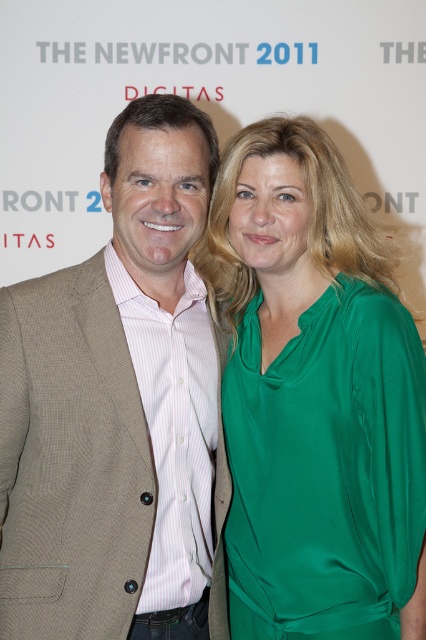
Is green satin blouse at center below brown textured blazer at left?

Yes, green satin blouse at center is below brown textured blazer at left.

Between green satin blouse at center and brown textured blazer at left, which one is positioned lower?

Positioned lower is green satin blouse at center.

Which is in front, point (425, 547) or point (155, 378)?

Point (425, 547)

Find the location of a particular element. This screenshot has width=426, height=640. green satin blouse at center is located at coordinates pyautogui.click(x=314, y=397).